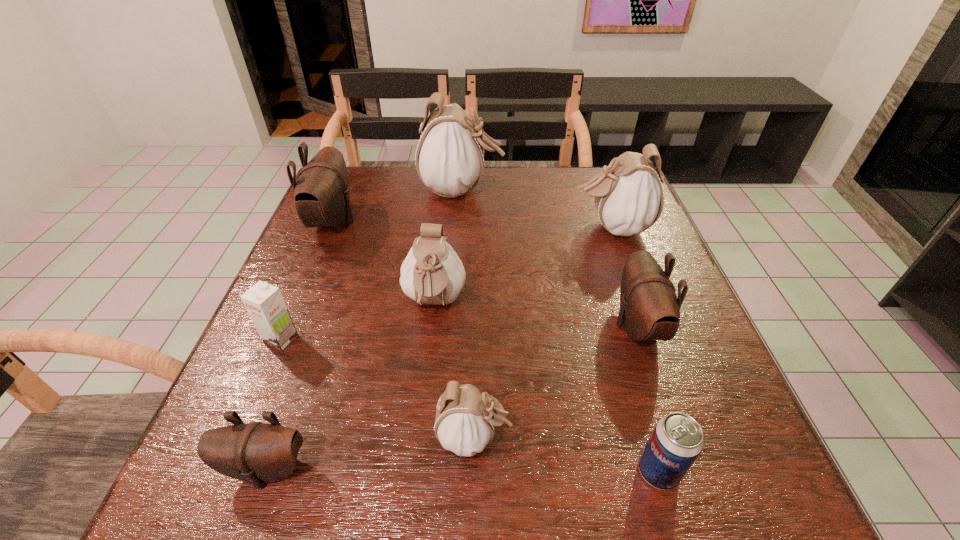
You are a GUI agent. You are given a task and a screenshot of the screen. Output one action in this format:
    pyautogui.click(x=<x>, y=<y>)
    Task: Click on the vacant region located on the front of the chocolate milk
    The image size is (960, 540).
    Given the screenshot: What is the action you would take?
    pyautogui.click(x=244, y=428)

Identify the location of free location located 0.280m on the front-facing side of the nearest white pouch. (680, 437).

Where is `free location located on the back of the red beer can`? This screenshot has height=540, width=960. free location located on the back of the red beer can is located at coordinates (608, 300).

You are a GUI agent. You are given a task and a screenshot of the screen. Output one action in this format:
    pyautogui.click(x=<x>, y=<y>)
    Task: Click on the beer can that is at the near edge
    
    Given the screenshot: What is the action you would take?
    pyautogui.click(x=677, y=439)

Find the location of `chocolate milk located in the left edge section of the desktop`. chocolate milk located in the left edge section of the desktop is located at coordinates (264, 302).

Where is `beer can that is at the right edge`? Image resolution: width=960 pixels, height=540 pixels. beer can that is at the right edge is located at coordinates tap(677, 439).

At what (x,y) coordinates should I click in order to perform the action: click on object that is at the far left corner. Please return your answer as a coordinate pair (x, y). The height and width of the screenshot is (540, 960). Looking at the image, I should click on (322, 192).

At what (x,y) coordinates should I click in order to perform the action: click on object that is at the near left corner. Please return your answer as a coordinate pair (x, y). This screenshot has width=960, height=540. Looking at the image, I should click on [x=256, y=452].

At what (x,y) coordinates should I click in order to perform the action: click on object present at the far right corner. Please return your answer as a coordinate pair (x, y). Image resolution: width=960 pixels, height=540 pixels. Looking at the image, I should click on (628, 195).

Find the location of a particular element. object that is at the near right corner is located at coordinates (677, 439).